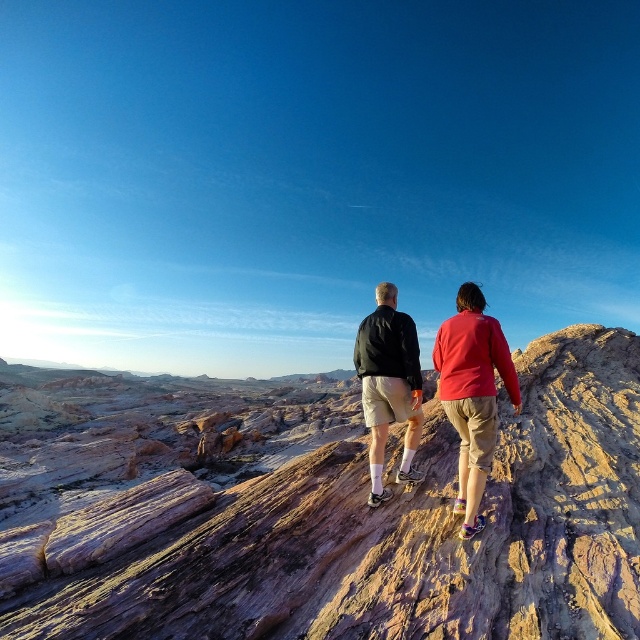
Looking at this image, you are standing at the center of the rocky outcrop and want to place a small marker exactly where the matte black jacket at center is located. What are the coordinates where you should place the marker?

The coordinates for the matte black jacket at center are at point (x=472, y=394).